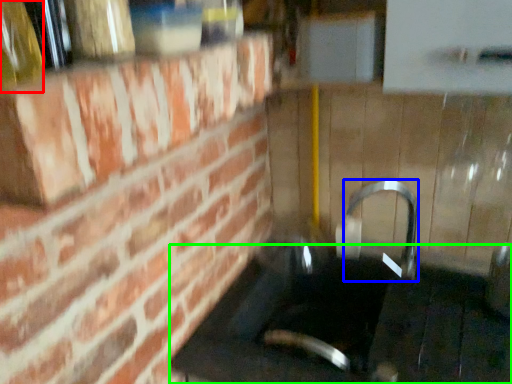
Question: Which object is positioned farthest from bottle (highlighted by a red box)? Select from faucet (highlighted by a blue box) and counter top (highlighted by a green box).

Choices:
 (A) faucet
 (B) counter top

Answer: (A)